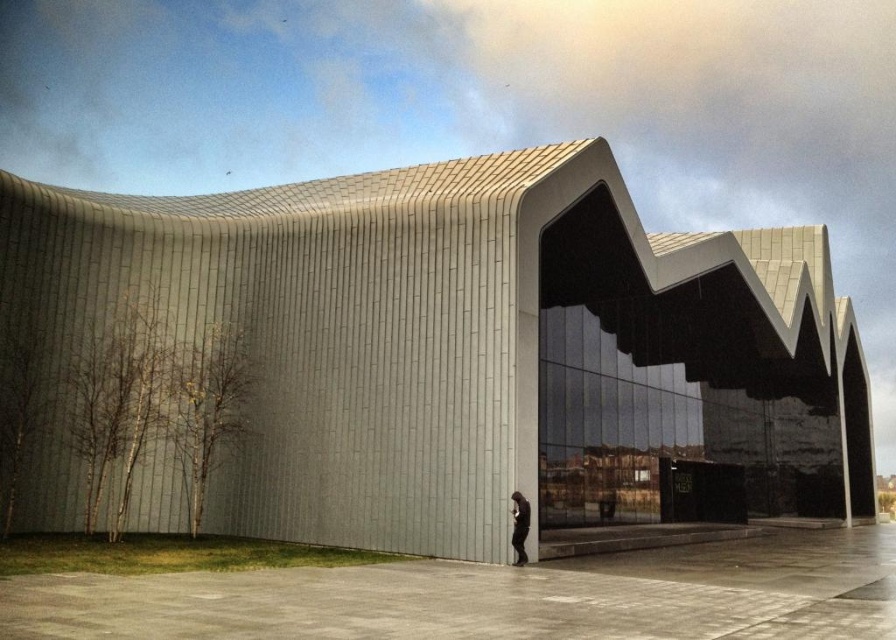
You are standing at the entrance of the sleek concrete building at center. If you walk straight ahead, will you eventually face the reflective glass section on the right side of the building?

The sleek concrete building at center is positioned at point (420, 362). Since the reflective glass section is on the right side of the building, walking straight ahead from the entrance would not face you towards the reflective glass section. You would need to turn right to face the reflective glass section on the right side of the building.

You are standing at the entrance of the sleek concrete building at center and want to take a photo of the dark gray fabric person at lower center. Which object will appear larger in the photo?

The dark gray fabric person at lower center will appear larger in the photo because they are closer to the camera than the sleek concrete building at center.